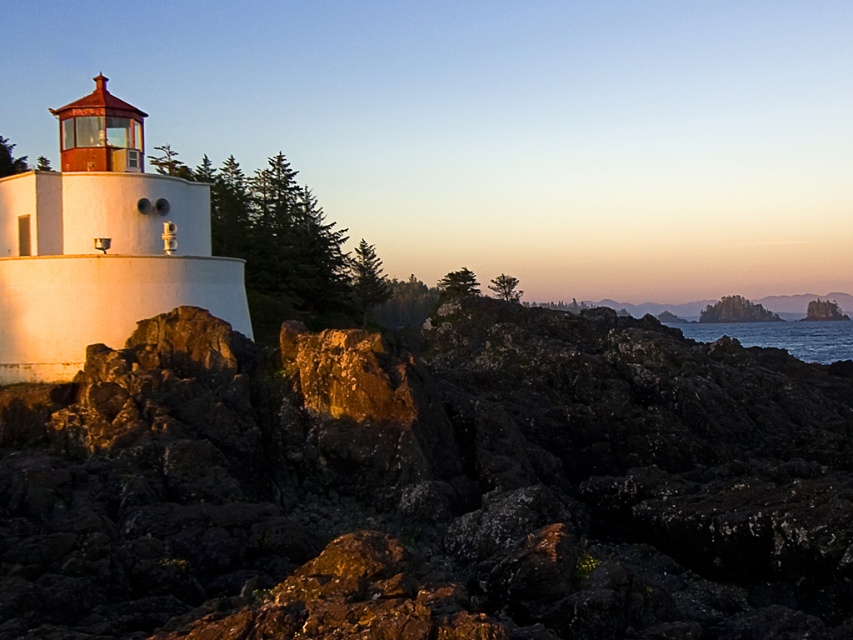
Can you confirm if rough textured rock at left is positioned above white matte lighthouse at left?

Actually, rough textured rock at left is below white matte lighthouse at left.

Is rough textured rock at left closer to the viewer compared to white matte lighthouse at left?

Yes, rough textured rock at left is closer to the viewer.

Find the location of `rough textured rock at left`. rough textured rock at left is located at coordinates (428, 484).

Consider the image. Is rough textured rock at left to the right of blue water at lower right from the viewer's perspective?

In fact, rough textured rock at left is to the left of blue water at lower right.

Does rough textured rock at left appear over blue water at lower right?

Correct, rough textured rock at left is located above blue water at lower right.

At what (x,y) coordinates should I click in order to perform the action: click on rough textured rock at left. Please return your answer as a coordinate pair (x, y). Looking at the image, I should click on (428, 484).

Is white matte lighthouse at left bigger than blue water at lower right?

No, white matte lighthouse at left is not bigger than blue water at lower right.

Does point (126, 141) come behind point (762, 342)?

No, it is in front of (762, 342).

Who is more distant from viewer, (13, 330) or (759, 340)?

Point (759, 340)

The width and height of the screenshot is (853, 640). Identify the location of white matte lighthouse at left. (102, 246).